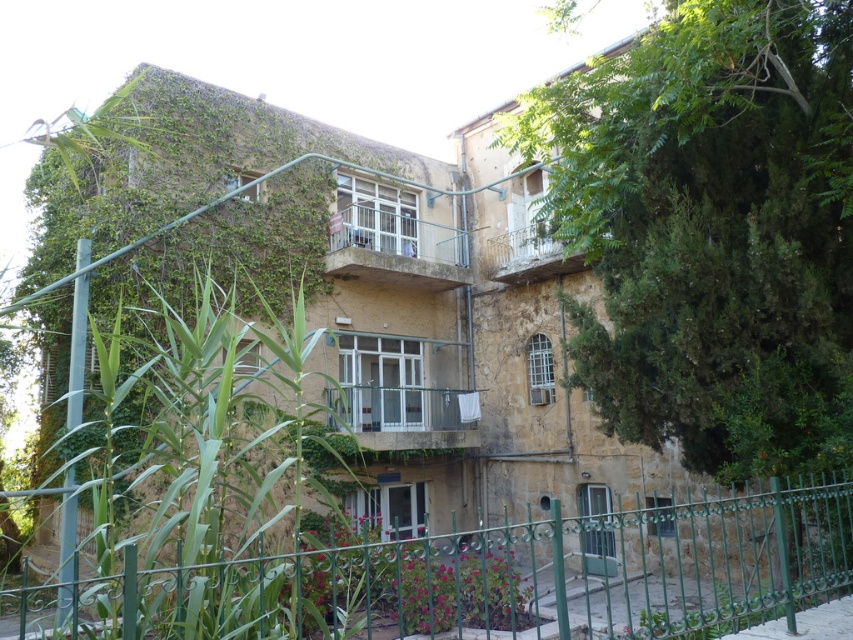
You are a delivery person trying to determine the best path to approach the building. You notice the green metal fence at lower center and the white wrought iron balcony at upper center. Which of these two objects is bigger in size?

The green metal fence at lower center is larger in size compared to the white wrought iron balcony at upper center according to the description.

You are a delivery person standing at the entrance of the property. You need to place a package on the ground near the green metal fence at lower center without getting too close to the white wrought iron balcony at upper center. Given that the minimum safe distance is 6 meters, is this possible?

The green metal fence at lower center and white wrought iron balcony at upper center are 6.23 meters apart. Since the minimum safe distance is 6 meters, placing the package near the green metal fence at lower center would be safe as the distance exceeds the required 6 meters.